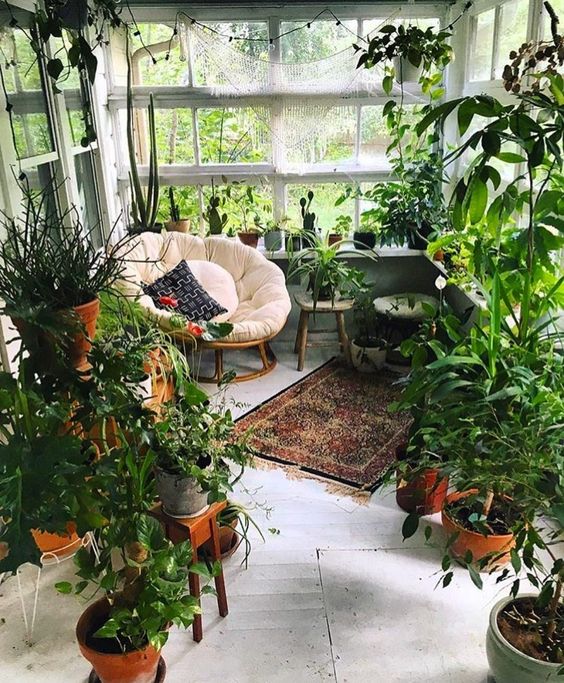
The height and width of the screenshot is (683, 564). I want to click on string of lights, so point(308,26).